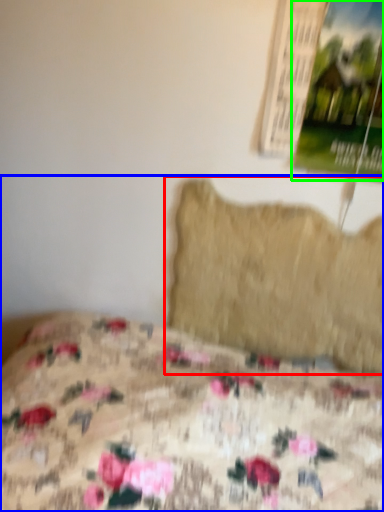
Question: Which is nearer to the pillow (highlighted by a red box)? bed (highlighted by a blue box) or poster page (highlighted by a green box).

Choices:
 (A) bed
 (B) poster page

Answer: (B)